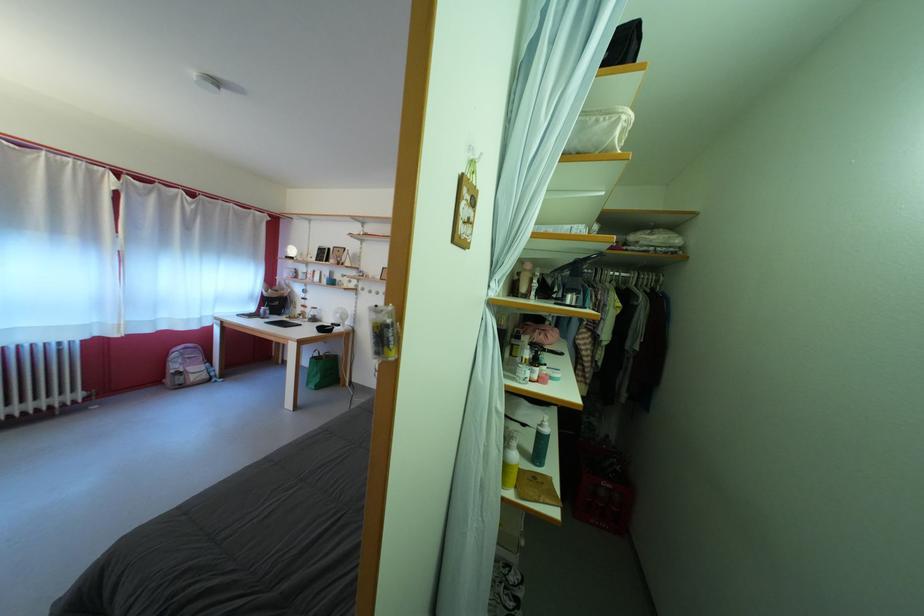
Which object does [623,277] point to?

This point indicates the black clothes hanger.